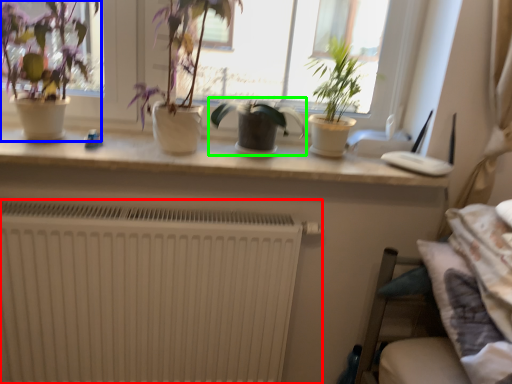
Question: Which object is the closest to the radiator (highlighted by a red box)? Choose among these: houseplant (highlighted by a blue box) or houseplant (highlighted by a green box).

Choices:
 (A) houseplant
 (B) houseplant

Answer: (A)